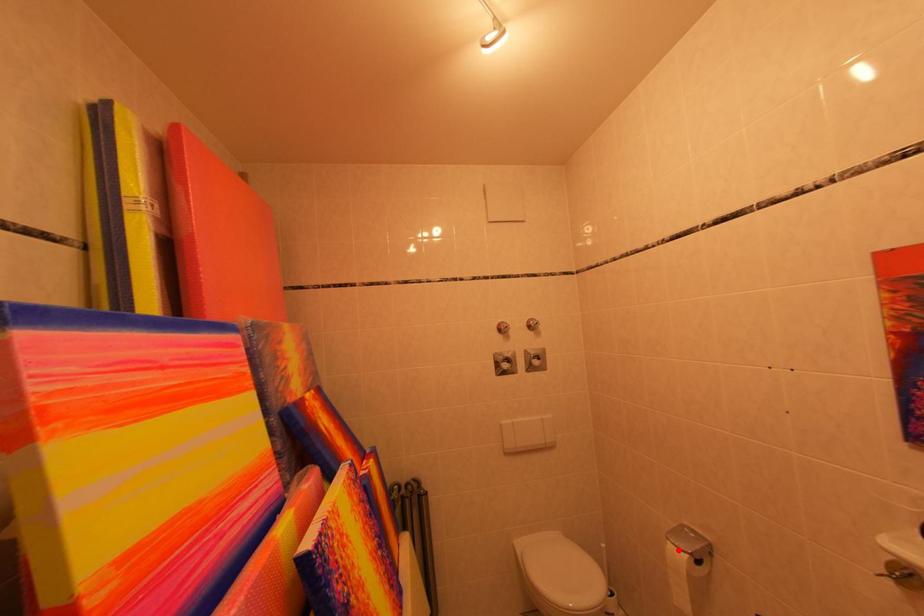
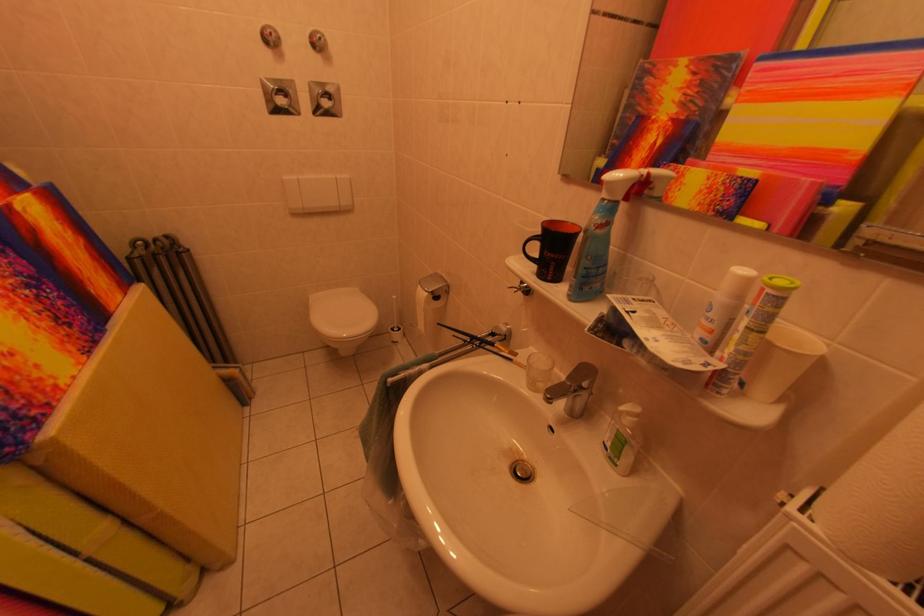
In the second image, find the point that corresponds to the highlighted location in the first image.

(429, 292)